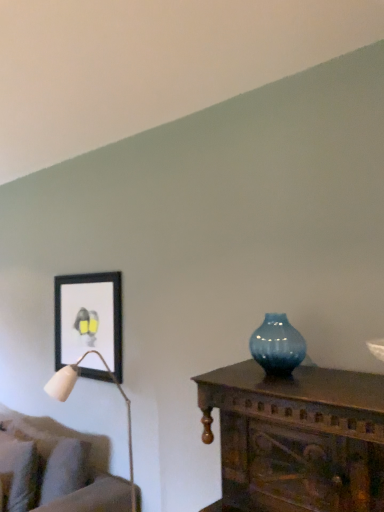
Question: Is black matte picture frame at upper left not near velvet beige couch at lower left?

Choices:
 (A) no
 (B) yes

Answer: (A)

Question: Is black matte picture frame at upper left to the right of velvet beige couch at lower left from the viewer's perspective?

Choices:
 (A) yes
 (B) no

Answer: (A)

Question: Is black matte picture frame at upper left bigger than velvet beige couch at lower left?

Choices:
 (A) no
 (B) yes

Answer: (A)

Question: Can you confirm if black matte picture frame at upper left is smaller than velvet beige couch at lower left?

Choices:
 (A) yes
 (B) no

Answer: (A)

Question: Considering the relative sizes of black matte picture frame at upper left and velvet beige couch at lower left in the image provided, is black matte picture frame at upper left taller than velvet beige couch at lower left?

Choices:
 (A) yes
 (B) no

Answer: (B)

Question: Does point (109, 505) appear closer or farther from the camera than point (61, 324)?

Choices:
 (A) farther
 (B) closer

Answer: (B)

Question: Considering the positions of velvet beige couch at lower left and black matte picture frame at upper left in the image, is velvet beige couch at lower left bigger or smaller than black matte picture frame at upper left?

Choices:
 (A) small
 (B) big

Answer: (B)

Question: Which is correct: velvet beige couch at lower left is inside black matte picture frame at upper left, or outside of it?

Choices:
 (A) outside
 (B) inside

Answer: (A)

Question: From the image's perspective, is velvet beige couch at lower left positioned above or below black matte picture frame at upper left?

Choices:
 (A) above
 (B) below

Answer: (B)

Question: Would you say velvet beige couch at lower left is inside or outside blue glass vase at center?

Choices:
 (A) inside
 (B) outside

Answer: (B)

Question: Considering the positions of point (51, 475) and point (286, 366), is point (51, 475) closer or farther from the camera than point (286, 366)?

Choices:
 (A) farther
 (B) closer

Answer: (A)

Question: From the image's perspective, is velvet beige couch at lower left located above or below blue glass vase at center?

Choices:
 (A) above
 (B) below

Answer: (B)

Question: Considering their positions, is velvet beige couch at lower left located in front of or behind blue glass vase at center?

Choices:
 (A) front
 (B) behind

Answer: (B)

Question: Would you say black matte picture frame at upper left is inside or outside blue glass vase at center?

Choices:
 (A) inside
 (B) outside

Answer: (B)

Question: Is black matte picture frame at upper left taller or shorter than blue glass vase at center?

Choices:
 (A) short
 (B) tall

Answer: (B)